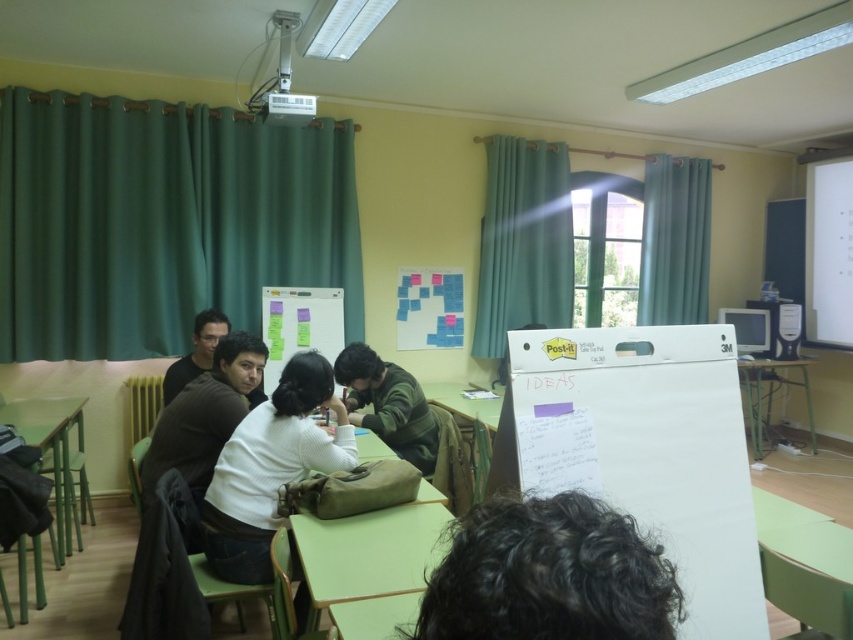
You are standing in the classroom and want to move from the whiteboard to the beige bag. Which point, point (659, 564) or point (207, 352), is closer to the beige bag?

Point (659, 564) is in front of point (207, 352), so it is closer to the beige bag.

You are a student sitting at the table in the classroom. You notice a dark curly hair at lower center and a dark brown sweater at left. Which object is located lower in the image?

The dark curly hair at lower center is positioned under the dark brown sweater at left, so it is located lower in the image.